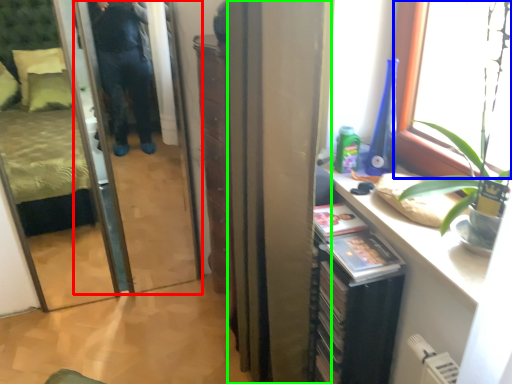
Question: Estimate the real-world distances between objects in this image. Which object is closer to screen door (highlighted by a red box), window (highlighted by a blue box) or curtain (highlighted by a green box)?

Choices:
 (A) window
 (B) curtain

Answer: (B)